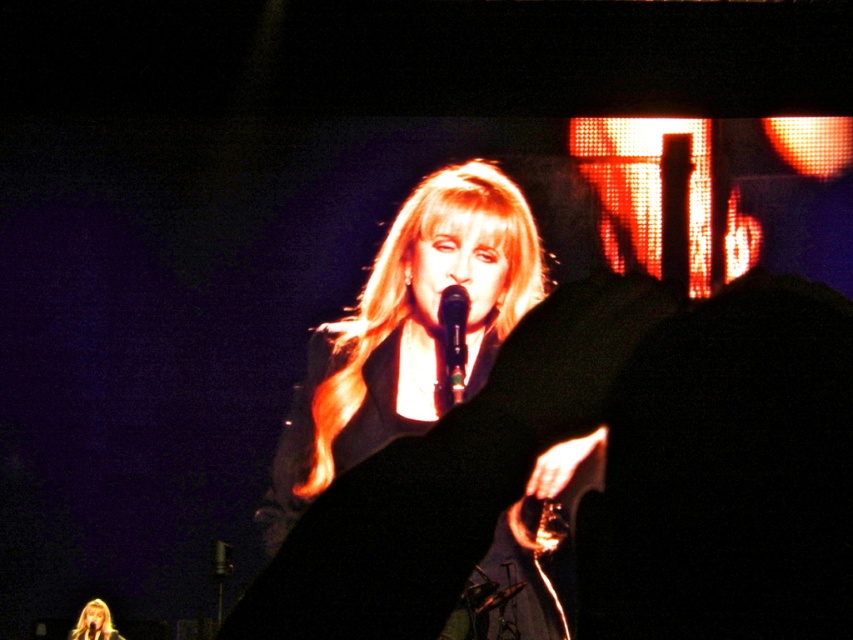
Question: Does blondehair at center have a smaller size compared to shiny black microphone at center?

Choices:
 (A) no
 (B) yes

Answer: (A)

Question: From the image, what is the correct spatial relationship of blondehair at center in relation to shiny black microphone at center?

Choices:
 (A) left
 (B) right

Answer: (A)

Question: Among these points, which one is farthest from the camera?

Choices:
 (A) (332, 460)
 (B) (93, 600)
 (C) (462, 314)

Answer: (A)

Question: Observing the image, what is the correct spatial positioning of shiny black microphone at center in reference to smooth blonde hair at center?

Choices:
 (A) above
 (B) below

Answer: (A)

Question: Among these objects, which one is nearest to the camera?

Choices:
 (A) blondehair at center
 (B) shiny black microphone at center
 (C) smooth blonde hair at center

Answer: (B)

Question: Which object is positioned farthest from the blondehair at center?

Choices:
 (A) smooth blonde hair at center
 (B) shiny black microphone at center

Answer: (A)